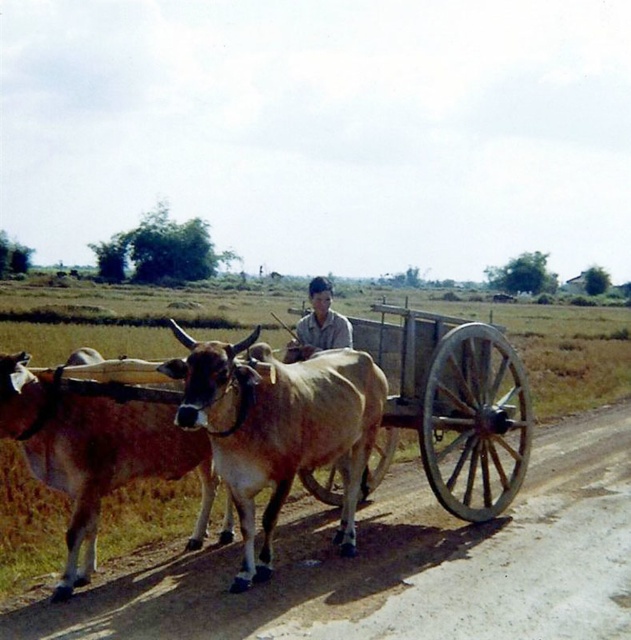
Question: Among these points, which one is farthest from the camera?

Choices:
 (A) (628, 452)
 (B) (348, 384)

Answer: (A)

Question: Can you confirm if brown dirt track at lower center is positioned to the right of light brown wooden cart at center?

Choices:
 (A) yes
 (B) no

Answer: (A)

Question: Which point is closer to the camera taking this photo?

Choices:
 (A) (533, 600)
 (B) (189, 372)

Answer: (B)

Question: Can you confirm if brown dirt track at lower center is bigger than brown glossy bull at center?

Choices:
 (A) no
 (B) yes

Answer: (B)

Question: Estimate the real-world distances between objects in this image. Which object is farther from the brown glossy bull at center?

Choices:
 (A) brown dirt track at lower center
 (B) light brown wooden cart at center

Answer: (A)

Question: Is brown glossy bull at center closer to the viewer compared to light brown wooden cart at center?

Choices:
 (A) no
 (B) yes

Answer: (B)